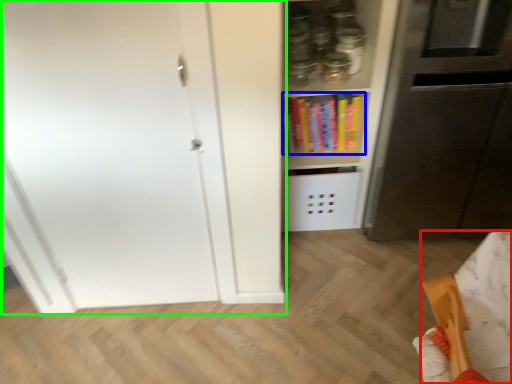
Question: Which object is positioned closest to furniture (highlighted by a red box)? Select from book (highlighted by a blue box) and door (highlighted by a green box).

Choices:
 (A) book
 (B) door

Answer: (B)